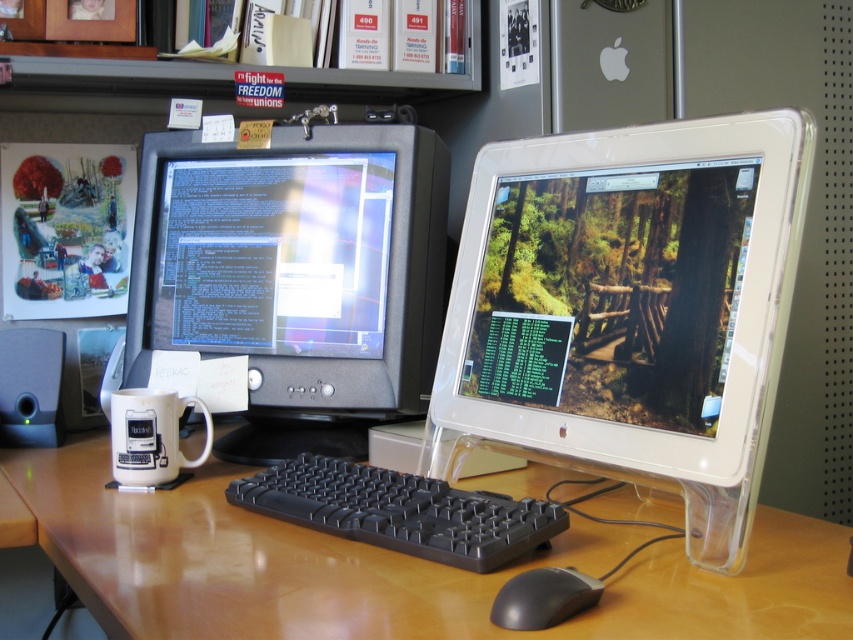
Question: Which point is farther to the camera?

Choices:
 (A) white ceramic mug at lower left
 (B) black plastic mouse at lower center

Answer: (A)

Question: Which of the following is the closest to the observer?

Choices:
 (A) (434, 545)
 (B) (231, 595)

Answer: (B)

Question: Is matte black monitor at left positioned at the back of white ceramic mug at lower left?

Choices:
 (A) no
 (B) yes

Answer: (B)

Question: From the image, what is the correct spatial relationship of white plastic monitor at center in relation to black plastic keyboard at center?

Choices:
 (A) right
 (B) left

Answer: (A)

Question: Which point is closer to the camera taking this photo?

Choices:
 (A) (141, 404)
 (B) (769, 525)

Answer: (B)

Question: Is brown wood computer desk at center thinner than white ceramic mug at lower left?

Choices:
 (A) yes
 (B) no

Answer: (B)